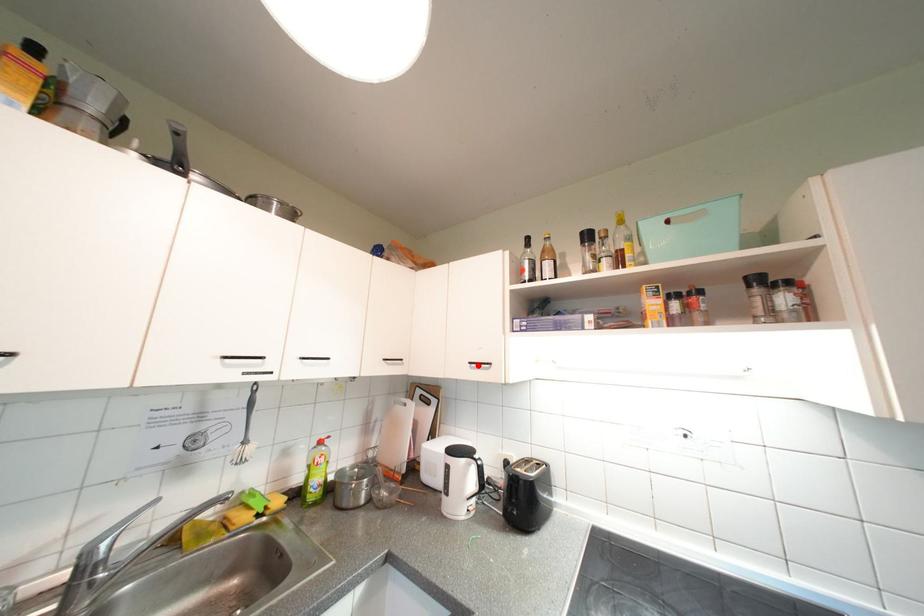
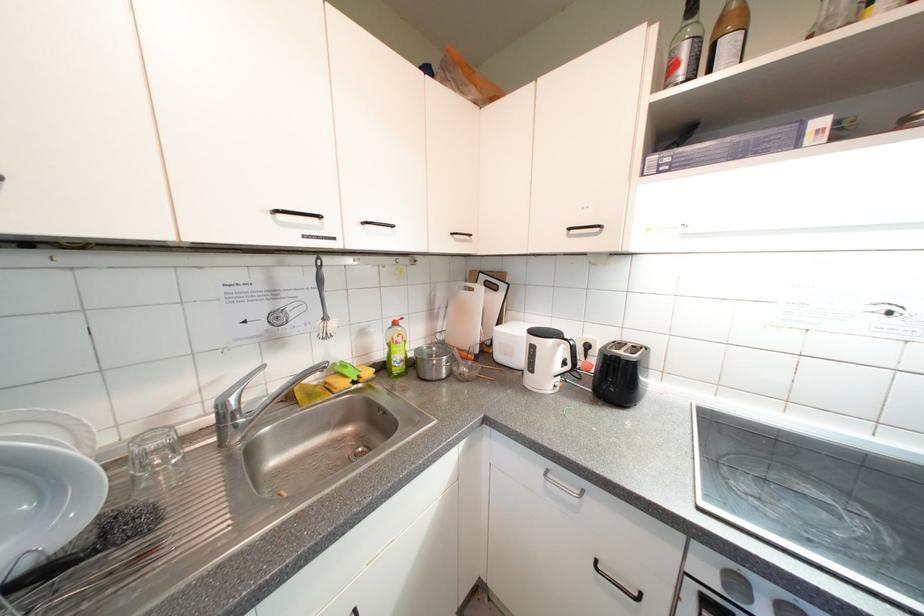
Find the pixel in the second image that matches the highlighted location in the first image.

(578, 231)